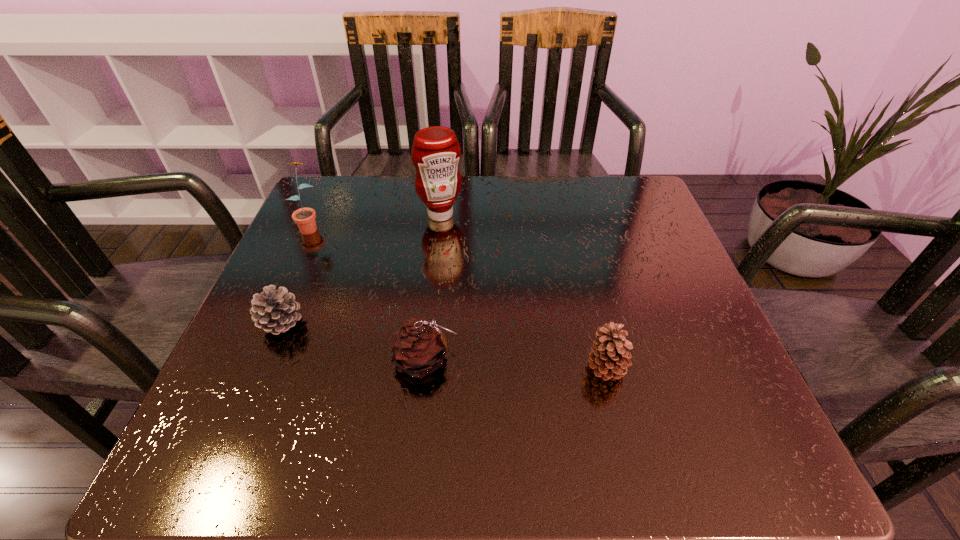
This screenshot has height=540, width=960. Identify the location of free point between the condiment and the second pinecone from left to right. (434, 287).

Identify the location of free space between the shortest object and the second tallest object. (296, 274).

Find the location of a particular element. object that stands as the closest to the condiment is located at coordinates click(x=305, y=217).

Where is `object that is the third closest to the rightmost pinecone`? object that is the third closest to the rightmost pinecone is located at coordinates (273, 310).

Find the location of a particular element. pinecone that is the second closest to the second pinecone from right to left is located at coordinates pos(609,358).

Select which pinecone appears as the third closest to the tallest object. Please provide its 2D coordinates. Your answer should be formatted as a tuple, i.e. [(x, y)], where the tuple contains the x and y coordinates of a point satisfying the conditions above.

[(609, 358)]

Locate an element on the screen. The width and height of the screenshot is (960, 540). blank space that satisfies the following two spatial constraints: 1. on the flower of the rightmost pinecone; 2. on the left side of the sunflower is located at coordinates (246, 368).

I want to click on vacant point that satisfies the following two spatial constraints: 1. on the flower of the sunflower; 2. on the left side of the rightmost object, so click(246, 368).

Identify the location of free spot that satisfies the following two spatial constraints: 1. with a leaf charm attached to the second pinecone from right to left; 2. on the right side of the rightmost object. (426, 368).

Locate an element on the screen. Image resolution: width=960 pixels, height=540 pixels. vacant position in the image that satisfies the following two spatial constraints: 1. on the flower of the rightmost object; 2. on the left side of the fourth shortest object is located at coordinates [246, 368].